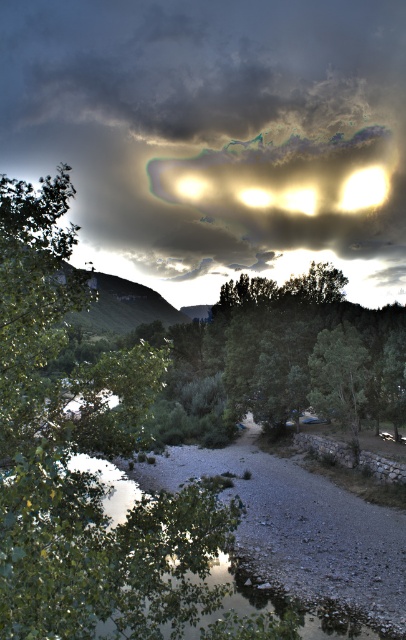
Can you confirm if cloudy sky at upper center is shorter than green leafy tree at left?

No.

Which is below, cloudy sky at upper center or green leafy tree at left?

green leafy tree at left

The image size is (406, 640). I want to click on cloudy sky at upper center, so click(215, 134).

Identify the location of cloudy sky at upper center. (215, 134).